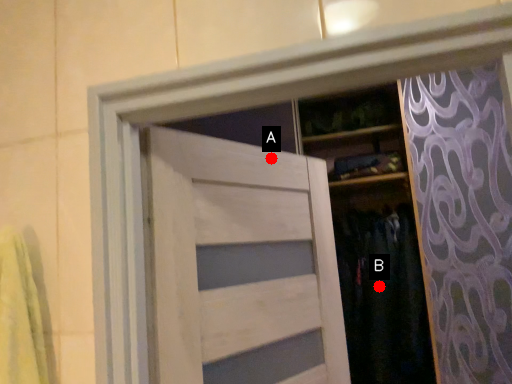
Question: Two points are circled on the image, labeled by A and B beside each circle. Which of the following is the farthest from the observer?

Choices:
 (A) A is further
 (B) B is further

Answer: (B)